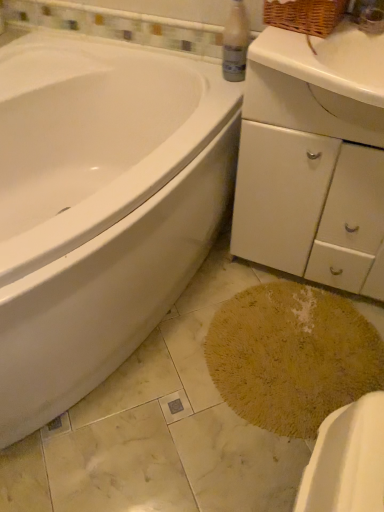
Question: Is yellow textured bath mat at lower center positioned with its back to yellow textured rug at lower center?

Choices:
 (A) no
 (B) yes

Answer: (A)

Question: Is yellow textured bath mat at lower center facing towards yellow textured rug at lower center?

Choices:
 (A) yes
 (B) no

Answer: (B)

Question: Considering the relative sizes of yellow textured bath mat at lower center and yellow textured rug at lower center in the image provided, is yellow textured bath mat at lower center thinner than yellow textured rug at lower center?

Choices:
 (A) no
 (B) yes

Answer: (A)

Question: Is yellow textured bath mat at lower center placed right next to yellow textured rug at lower center?

Choices:
 (A) no
 (B) yes

Answer: (A)

Question: Are yellow textured bath mat at lower center and yellow textured rug at lower center located far from each other?

Choices:
 (A) no
 (B) yes

Answer: (A)

Question: Looking at their shapes, would you say white glossy bathtub at left is wider or thinner than clear plastic bottle at upper center?

Choices:
 (A) wide
 (B) thin

Answer: (A)

Question: From their relative heights in the image, would you say white glossy bathtub at left is taller or shorter than clear plastic bottle at upper center?

Choices:
 (A) tall
 (B) short

Answer: (A)

Question: Considering the positions of white glossy bathtub at left and clear plastic bottle at upper center in the image, is white glossy bathtub at left bigger or smaller than clear plastic bottle at upper center?

Choices:
 (A) small
 (B) big

Answer: (B)

Question: In the image, is white glossy bathtub at left positioned in front of or behind clear plastic bottle at upper center?

Choices:
 (A) behind
 (B) front

Answer: (B)

Question: Is point (117, 174) closer or farther from the camera than point (379, 232)?

Choices:
 (A) farther
 (B) closer

Answer: (A)

Question: From a real-world perspective, relative to white matte cabinet at center-right, is white glossy bathtub at left vertically above or below?

Choices:
 (A) below
 (B) above

Answer: (A)

Question: Looking at their shapes, would you say white glossy bathtub at left is wider or thinner than white matte cabinet at center-right?

Choices:
 (A) thin
 (B) wide

Answer: (B)

Question: From the image's perspective, is white glossy bathtub at left located above or below white matte cabinet at center-right?

Choices:
 (A) below
 (B) above

Answer: (A)

Question: Is yellow textured rug at lower center taller or shorter than white glossy bathtub at left?

Choices:
 (A) tall
 (B) short

Answer: (B)

Question: From a real-world perspective, is yellow textured rug at lower center physically located above or below white glossy bathtub at left?

Choices:
 (A) below
 (B) above

Answer: (A)